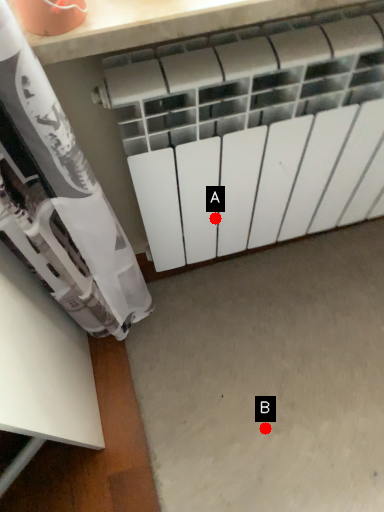
Question: Two points are circled on the image, labeled by A and B beside each circle. Which point is closer to the camera taking this photo?

Choices:
 (A) A is closer
 (B) B is closer

Answer: (A)